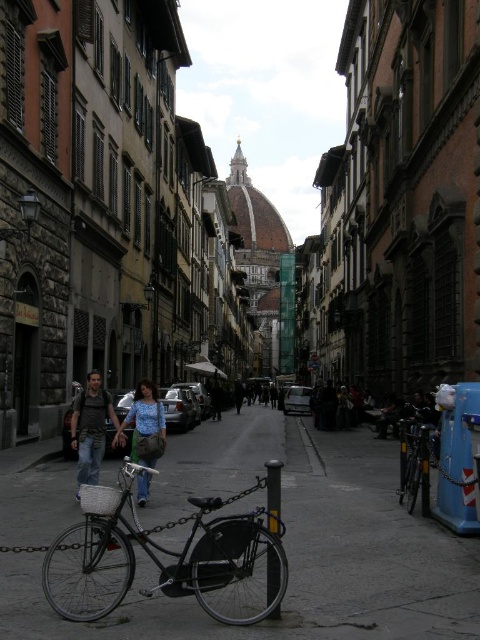
Which of these two, black matte bicycle at center or shiny black bicycle at right, stands shorter?

Standing shorter between the two is shiny black bicycle at right.

Is point (52, 557) closer to viewer compared to point (415, 440)?

Yes, point (52, 557) is closer to viewer.

Where is `black matte bicycle at center`? The image size is (480, 640). black matte bicycle at center is located at coordinates (165, 554).

This screenshot has height=640, width=480. Identify the location of black matte bicycle at center. (165, 554).

Based on the photo, is smooth concrete pavement at center taller than denim jeans at center?

Incorrect, smooth concrete pavement at center's height is not larger of denim jeans at center's.

Is smooth concrete pavement at center below denim jeans at center?

Yes.

Which is behind, point (291, 515) or point (91, 419)?

The point (91, 419) is behind.

Locate an element on the screen. This screenshot has width=480, height=640. smooth concrete pavement at center is located at coordinates (288, 545).

Can you confirm if black matte bicycle at center is shorter than denim pants at center?

Yes.

Is black matte bicycle at center thinner than denim pants at center?

In fact, black matte bicycle at center might be wider than denim pants at center.

The width and height of the screenshot is (480, 640). Find the location of `black matte bicycle at center`. black matte bicycle at center is located at coordinates pos(165,554).

Identify the location of black matte bicycle at center. (165, 554).